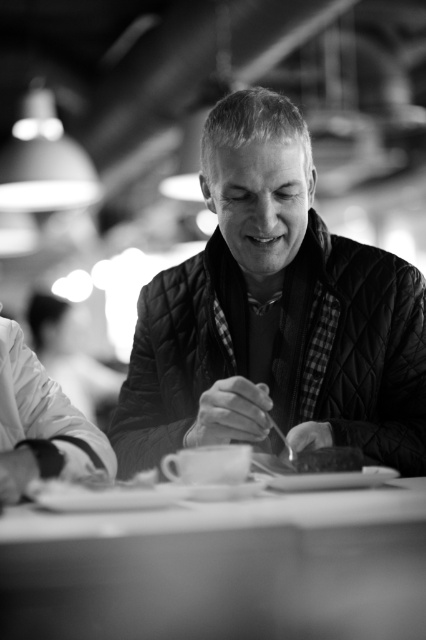
Question: Is smooth white table at center below smooth chocolate bar at center?

Choices:
 (A) yes
 (B) no

Answer: (A)

Question: Which of the following is the farthest from the observer?

Choices:
 (A) (354, 365)
 (B) (8, 547)
 (C) (305, 458)

Answer: (A)

Question: Which point is closer to the camera taking this photo?

Choices:
 (A) (313, 276)
 (B) (310, 461)
 (C) (333, 492)

Answer: (C)

Question: Is quilted fabric jacket at center bigger than smooth chocolate bar at center?

Choices:
 (A) yes
 (B) no

Answer: (A)

Question: Among these points, which one is nearest to the camera?

Choices:
 (A) (80, 557)
 (B) (296, 401)
 (C) (333, 461)

Answer: (A)

Question: In this image, where is quilted fabric jacket at center located relative to smooth chocolate bar at center?

Choices:
 (A) above
 (B) below

Answer: (A)